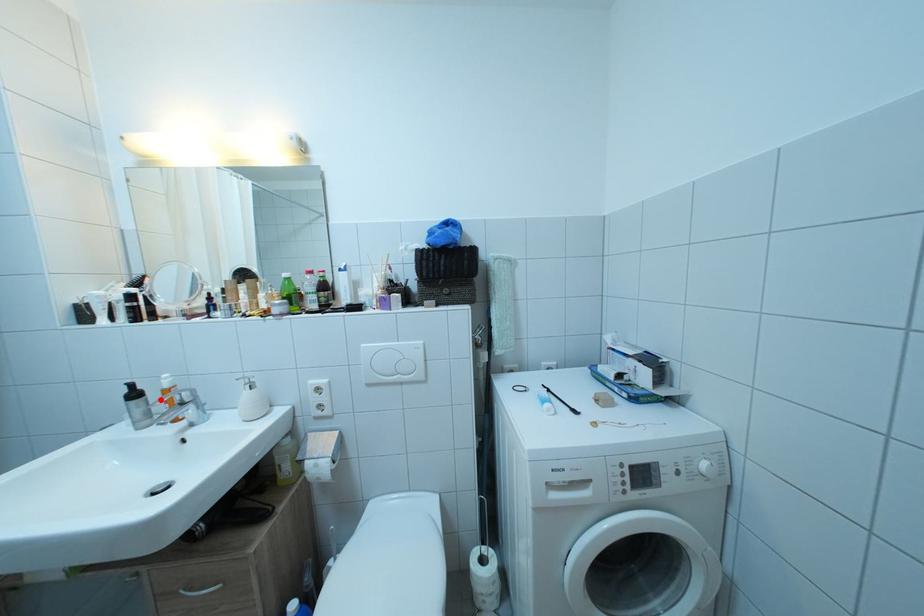
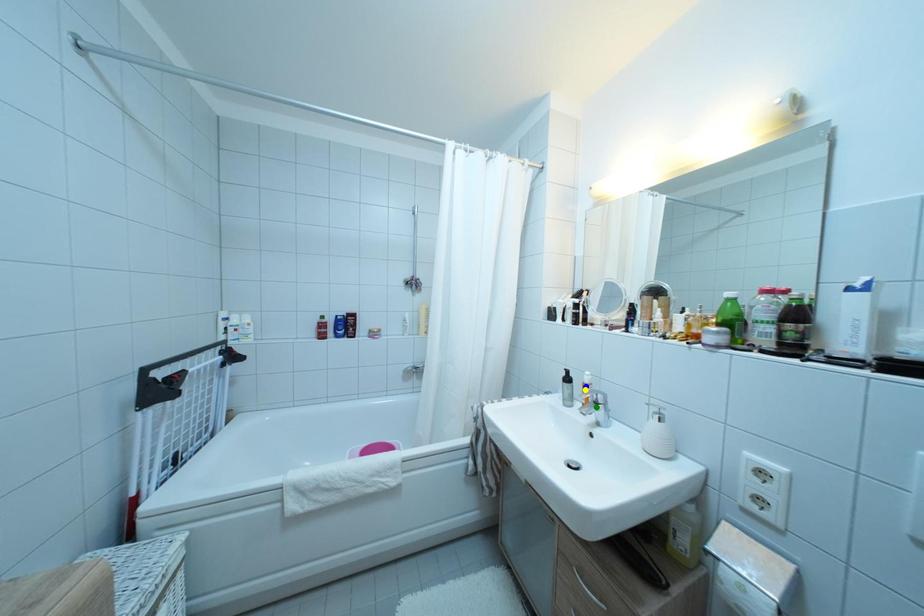
Question: I am providing you with two images of the same scene from different viewpoints. A red point is marked on the first image. You are given multiple points on the second image. Which point in image 2 represents the same 3d spot as the red point in image 1?

Choices:
 (A) blue point
 (B) green point
 (C) yellow point

Answer: (C)